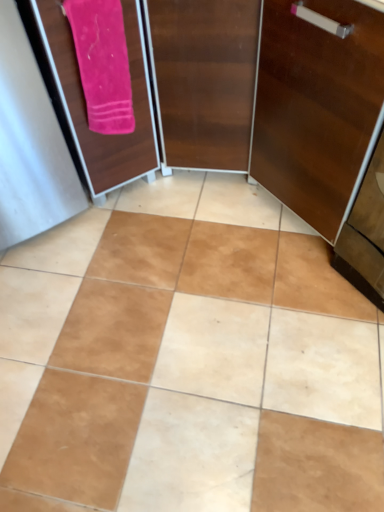
Question: Is pink fabric screen door at upper left completely or partially outside of pink soft towel at upper left?

Choices:
 (A) no
 (B) yes

Answer: (B)

Question: Is pink fabric screen door at upper left positioned with its back to pink soft towel at upper left?

Choices:
 (A) no
 (B) yes

Answer: (A)

Question: Is pink fabric screen door at upper left at the right side of pink soft towel at upper left?

Choices:
 (A) no
 (B) yes

Answer: (A)

Question: Can you confirm if pink fabric screen door at upper left is bigger than pink soft towel at upper left?

Choices:
 (A) yes
 (B) no

Answer: (A)

Question: Does pink fabric screen door at upper left come behind pink soft towel at upper left?

Choices:
 (A) yes
 (B) no

Answer: (B)

Question: Is pink fabric screen door at upper left far away from pink soft towel at upper left?

Choices:
 (A) yes
 (B) no

Answer: (B)

Question: From a real-world perspective, is wooden cabinet at right physically below pink soft towel at upper left?

Choices:
 (A) yes
 (B) no

Answer: (A)

Question: Are wooden cabinet at right and pink soft towel at upper left located far from each other?

Choices:
 (A) yes
 (B) no

Answer: (B)

Question: Does wooden cabinet at right have a larger size compared to pink soft towel at upper left?

Choices:
 (A) no
 (B) yes

Answer: (B)

Question: From the image's perspective, would you say wooden cabinet at right is shown under pink soft towel at upper left?

Choices:
 (A) no
 (B) yes

Answer: (B)

Question: Are wooden cabinet at right and pink soft towel at upper left beside each other?

Choices:
 (A) yes
 (B) no

Answer: (B)

Question: Is wooden cabinet at right positioned beyond the bounds of pink soft towel at upper left?

Choices:
 (A) yes
 (B) no

Answer: (A)

Question: Is pink soft towel at upper left turned away from pink fabric screen door at upper left?

Choices:
 (A) yes
 (B) no

Answer: (A)